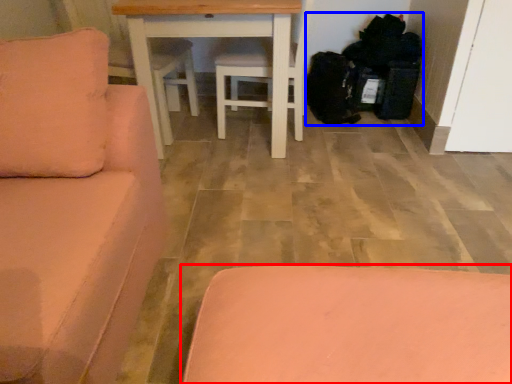
Question: Among these objects, which one is farthest to the camera, furniture (highlighted by a red box) or garbage (highlighted by a blue box)?

Choices:
 (A) furniture
 (B) garbage

Answer: (B)